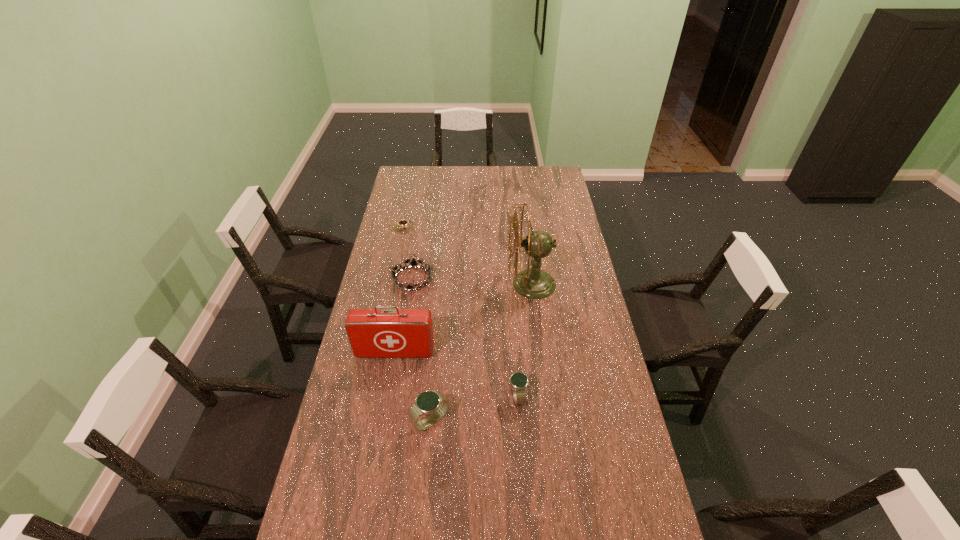
The image size is (960, 540). I want to click on free area in between the second watch from right to left and the fourth farthest object, so click(x=413, y=387).

What are the coordinates of `vacant space in between the shortest object and the fifth shortest object` in the screenshot? It's located at (399, 290).

You are a GUI agent. You are given a task and a screenshot of the screen. Output one action in this format:
    pyautogui.click(x=<x>, y=<y>)
    Task: Click on the unoccupied area between the third nearest object and the fourth tallest object
    The height and width of the screenshot is (540, 960).
    Given the screenshot: What is the action you would take?
    pyautogui.click(x=456, y=374)

Locate an element on the screen. This screenshot has height=540, width=960. free space between the tiara and the tallest object is located at coordinates (472, 281).

At what (x,y) coordinates should I click in order to perform the action: click on object that is the third closest to the second tallest watch. Please return your answer as a coordinate pair (x, y). This screenshot has height=540, width=960. Looking at the image, I should click on (534, 283).

Identify which object is located as the nearest to the shortest watch. Please provide its 2D coordinates. Your answer should be formatted as a tuple, i.e. [(x, y)], where the tuple contains the x and y coordinates of a point satisfying the conditions above.

[(413, 263)]

Identify the location of watch that is the second closest one to the rightmost watch. The width and height of the screenshot is (960, 540). (402, 222).

Find the location of `watch that stands as the second closest to the leftmost watch`. watch that stands as the second closest to the leftmost watch is located at coordinates (518, 380).

You are a GUI agent. You are given a task and a screenshot of the screen. Output one action in this format:
    pyautogui.click(x=<x>, y=<y>)
    Task: Click on the vacant space that satisfies the following two spatial constraints: 1. on the front-facing side of the fifth tallest object; 2. on the side of the fifth shortest object with the first aid cross symbol
    The height and width of the screenshot is (540, 960).
    Given the screenshot: What is the action you would take?
    pyautogui.click(x=400, y=352)

The height and width of the screenshot is (540, 960). I want to click on vacant region that satisfies the following two spatial constraints: 1. on the back side of the rightmost watch; 2. on the front-facing side of the second shortest object, so click(x=510, y=279).